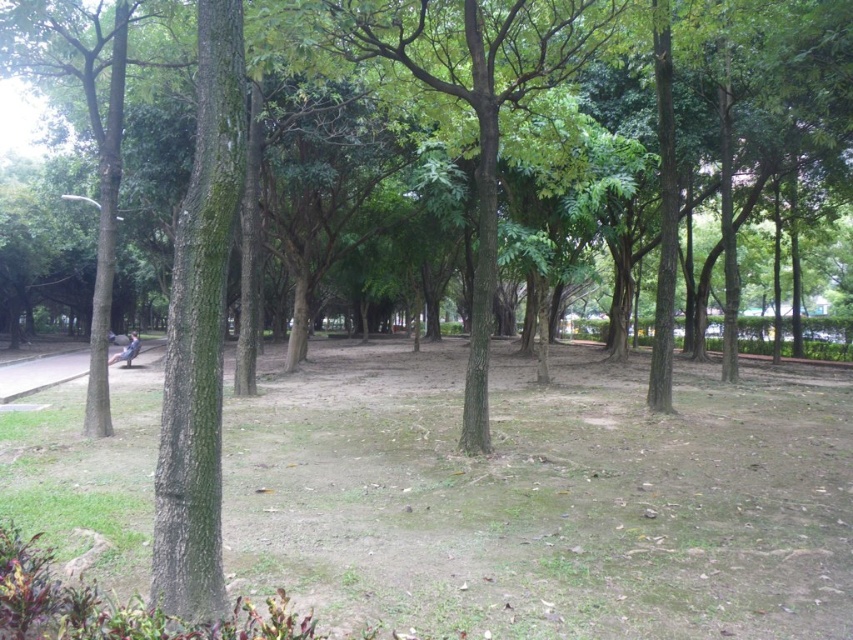
Is green leafy tree at center to the left of brown rough tree at left from the viewer's perspective?

In fact, green leafy tree at center is to the right of brown rough tree at left.

Find the location of a particular element. The image size is (853, 640). green leafy tree at center is located at coordinates point(457,93).

Where is `green leafy tree at center`? green leafy tree at center is located at coordinates [x=457, y=93].

In the scene shown: Does green grass at center have a greater height compared to smooth concrete path at lower left?

Incorrect, green grass at center's height is not larger of smooth concrete path at lower left's.

Measure the distance between green grass at center and camera.

green grass at center is 3.73 meters away from camera.

In the scene shown: Who is more forward, [437,397] or [86,358]?

Positioned in front is point [437,397].

Find the location of a particular element. Image resolution: width=853 pixels, height=640 pixels. green grass at center is located at coordinates (544, 499).

Is green leafy tree at center bigger than smooth concrete path at lower left?

No, green leafy tree at center is not bigger than smooth concrete path at lower left.

Is point (482, 376) farther from camera compared to point (65, 372)?

That is False.

Identify the location of green leafy tree at center. (457, 93).